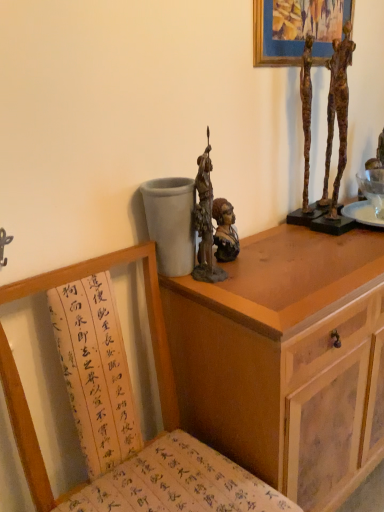
Question: Should I look upward or downward to see wooden chair with calligraphy cushion at lower left?

Choices:
 (A) up
 (B) down

Answer: (B)

Question: Is wooden cabinet at upper right not inside rusty bronze statue at center?

Choices:
 (A) yes
 (B) no

Answer: (A)

Question: Is wooden cabinet at upper right smaller than rusty bronze statue at center?

Choices:
 (A) no
 (B) yes

Answer: (A)

Question: Is wooden cabinet at upper right far from rusty bronze statue at center?

Choices:
 (A) no
 (B) yes

Answer: (A)

Question: Does wooden cabinet at upper right have a greater height compared to rusty bronze statue at center?

Choices:
 (A) yes
 (B) no

Answer: (A)

Question: From the image's perspective, is wooden cabinet at upper right under rusty bronze statue at center?

Choices:
 (A) yes
 (B) no

Answer: (A)

Question: Is wooden cabinet at upper right facing towards rusty bronze statue at center?

Choices:
 (A) yes
 (B) no

Answer: (B)

Question: Does bronze bust at center, placed as the 2th person when sorted from right to left, have a greater height compared to rusty metal sculpture at upper right, which is counted as the 2th person, starting from the left?

Choices:
 (A) yes
 (B) no

Answer: (B)

Question: Is bronze bust at center, placed as the 2th person when sorted from right to left, located outside rusty metal sculpture at upper right, which is counted as the 2th person, starting from the left?

Choices:
 (A) yes
 (B) no

Answer: (A)

Question: Is the surface of bronze bust at center, placed as the 2th person when sorted from right to left, in direct contact with rusty metal sculpture at upper right, which ranks as the 1th person in right-to-left order?

Choices:
 (A) no
 (B) yes

Answer: (A)

Question: From a real-world perspective, does bronze bust at center, the first person positioned from the left, sit lower than rusty metal sculpture at upper right, which ranks as the 1th person in right-to-left order?

Choices:
 (A) no
 (B) yes

Answer: (B)

Question: From the image's perspective, is bronze bust at center, the first person positioned from the left, over rusty metal sculpture at upper right, which is counted as the 2th person, starting from the left?

Choices:
 (A) no
 (B) yes

Answer: (A)

Question: Is bronze bust at center, placed as the 2th person when sorted from right to left, at the left side of rusty metal sculpture at upper right, which is counted as the 2th person, starting from the left?

Choices:
 (A) yes
 (B) no

Answer: (A)

Question: Is rusty bronze statue at center with bronze bust at center, placed as the 2th person when sorted from right to left?

Choices:
 (A) no
 (B) yes

Answer: (B)